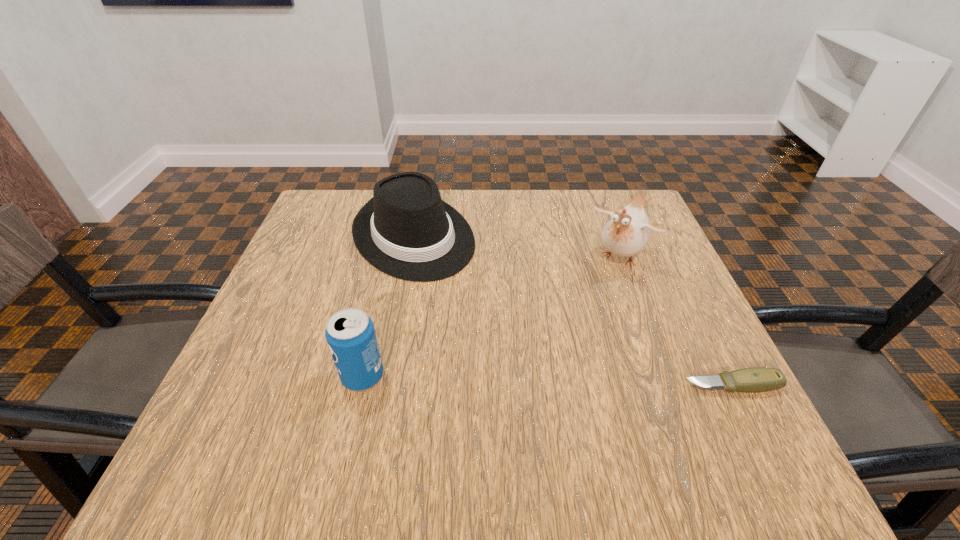
This screenshot has height=540, width=960. I want to click on soda can, so click(350, 334).

This screenshot has height=540, width=960. Find the location of `pocketknife`. pocketknife is located at coordinates (757, 379).

At what (x,y) coordinates should I click in order to perform the action: click on bird. Please return your answer as a coordinate pair (x, y). Looking at the image, I should click on (626, 233).

Locate an element on the screen. The image size is (960, 540). fedora is located at coordinates tap(406, 230).

Where is `free space located on the back of the soda can`? This screenshot has width=960, height=540. free space located on the back of the soda can is located at coordinates (389, 265).

This screenshot has width=960, height=540. I want to click on vacant space situated 0.280m on the back of the shortest object, so click(677, 273).

Image resolution: width=960 pixels, height=540 pixels. Find the location of `free space located at the beak of the tallest object`. free space located at the beak of the tallest object is located at coordinates (542, 359).

Where is `blank space located at the beak of the tallest object`? The height and width of the screenshot is (540, 960). blank space located at the beak of the tallest object is located at coordinates (542, 359).

The height and width of the screenshot is (540, 960). Identify the location of vacant space situated 0.290m at the beak of the tallest object. (542, 359).

Find the location of a particular element. The image size is (960, 540). vacant space located on the front-facing side of the fedora is located at coordinates click(459, 293).